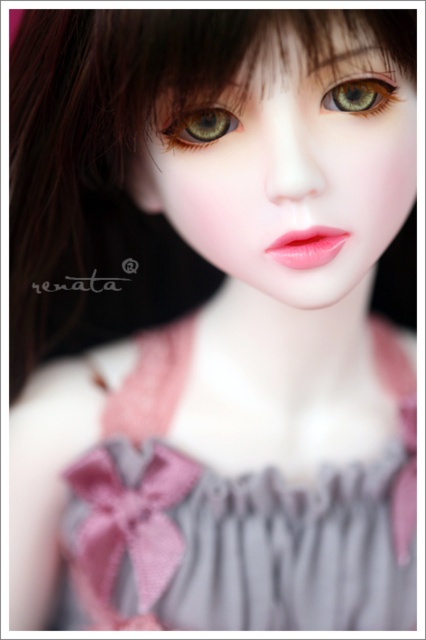
Question: Observing the image, what is the correct spatial positioning of pink satin dress at center in reference to green matte eye at center?

Choices:
 (A) below
 (B) above

Answer: (A)

Question: Is green matte eye at upper center above green matte eye at center?

Choices:
 (A) yes
 (B) no

Answer: (A)

Question: Among these objects, which one is farthest from the camera?

Choices:
 (A) matte plastic face at center
 (B) pink satin dress at center
 (C) green matte eye at upper center
 (D) green matte eye at center

Answer: (B)

Question: Which of the following is the farthest from the observer?

Choices:
 (A) (371, 97)
 (B) (301, 246)

Answer: (B)

Question: Does matte plastic face at center appear on the right side of green matte eye at center?

Choices:
 (A) yes
 (B) no

Answer: (A)

Question: Among these objects, which one is nearest to the camera?

Choices:
 (A) green matte eye at upper center
 (B) green matte eye at center

Answer: (A)